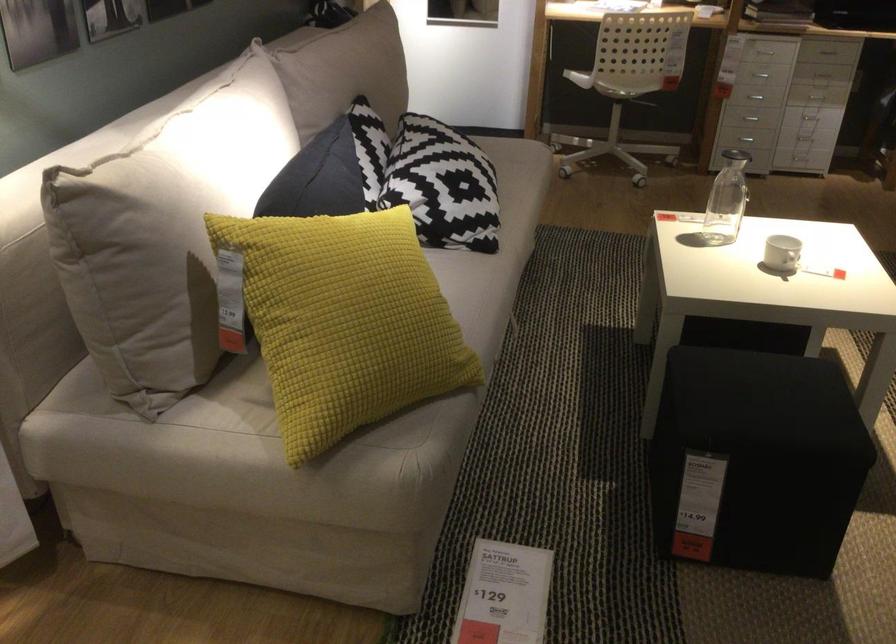
Find where to sit the chair sitting surface. Please return your answer as a coordinate pair (x, y).

(627, 80)